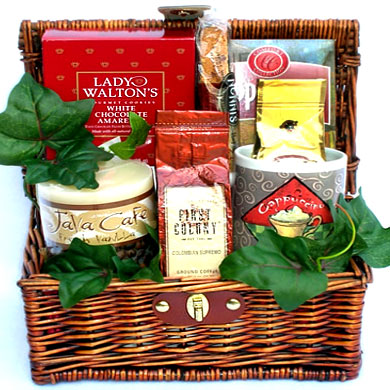
Where is `basket`? basket is located at coordinates [x=273, y=324].